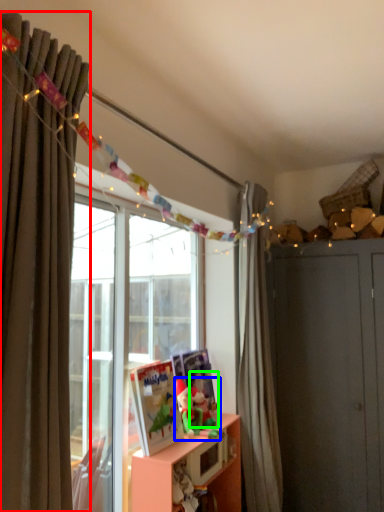
Question: Which object is the farthest from curtain (highlighted by a red box)? Choose among these: toy (highlighted by a blue box) or toy (highlighted by a green box).

Choices:
 (A) toy
 (B) toy

Answer: (B)